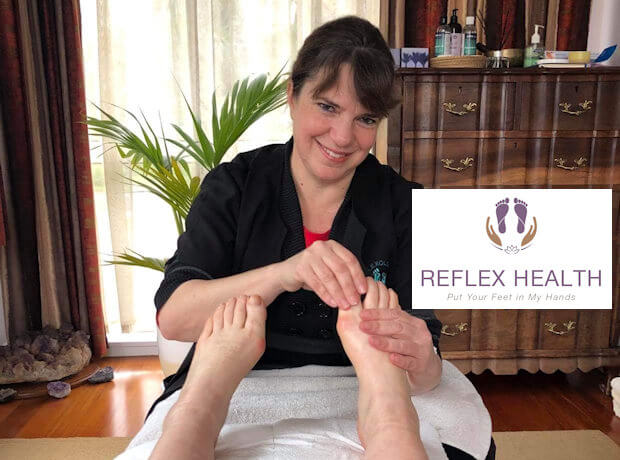
At what (x,y) coordinates should I click in order to perform the action: click on wooden floor. Please return your answer as a coordinate pair (x, y). This screenshot has width=620, height=460. Looking at the image, I should click on 89,397.